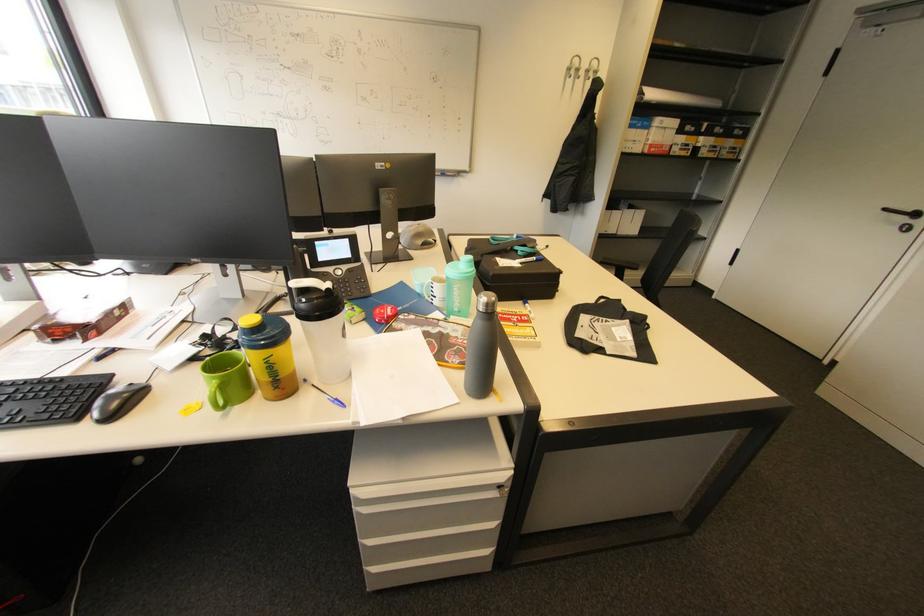
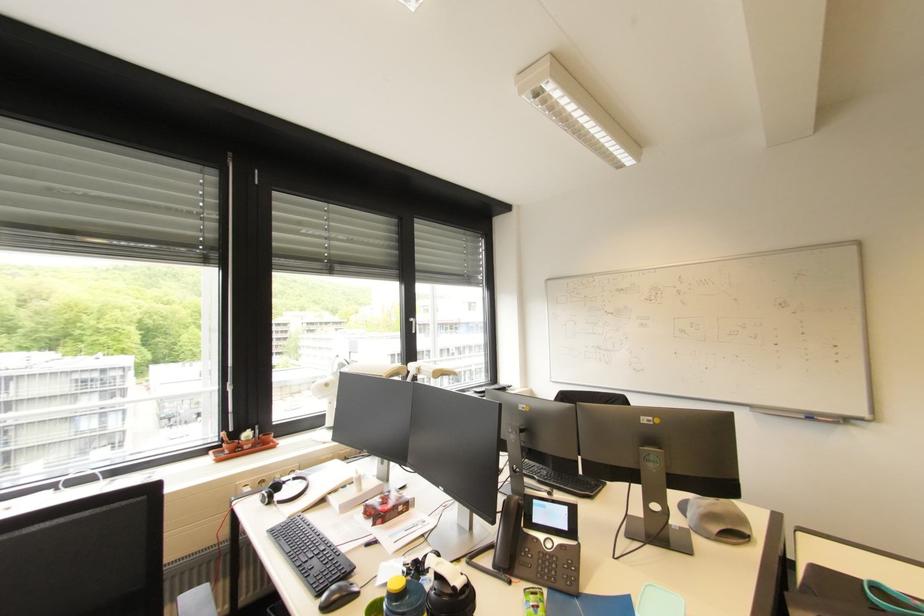
How did the camera likely rotate?

The rotation direction of the camera is left-up.